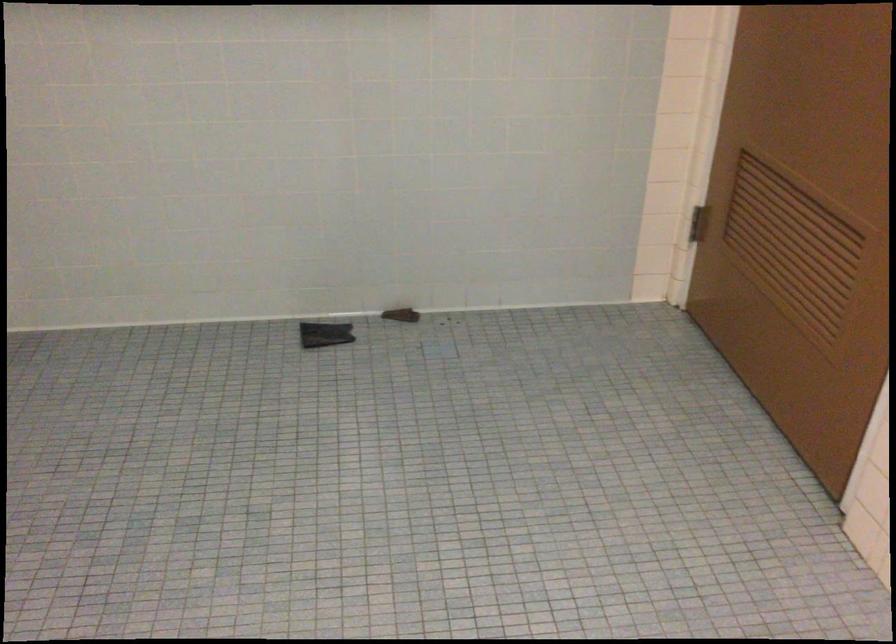
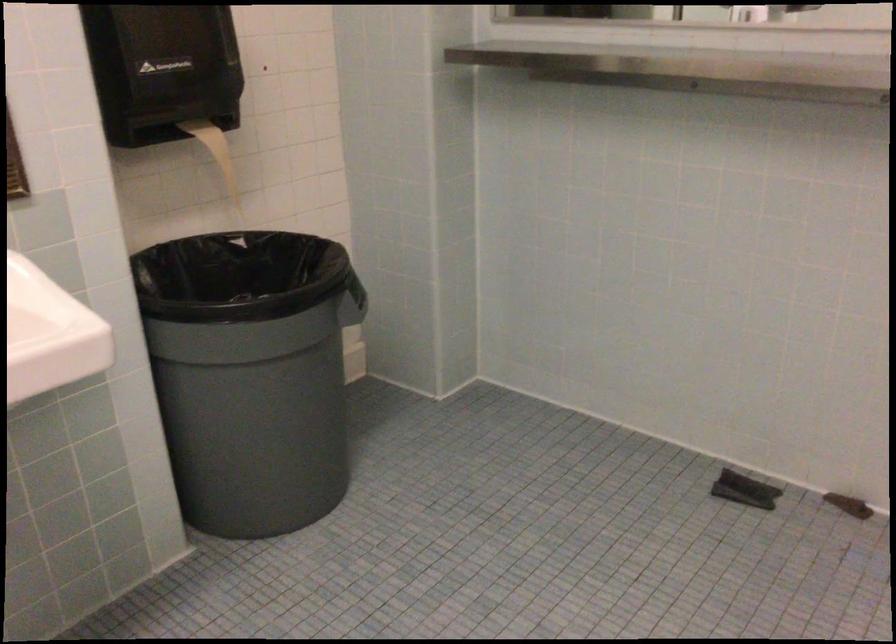
Question: The images are taken continuously from a first-person perspective. In which direction is your viewpoint rotating?

Choices:
 (A) Left
 (B) Right
 (C) Up
 (D) Down

Answer: (A)